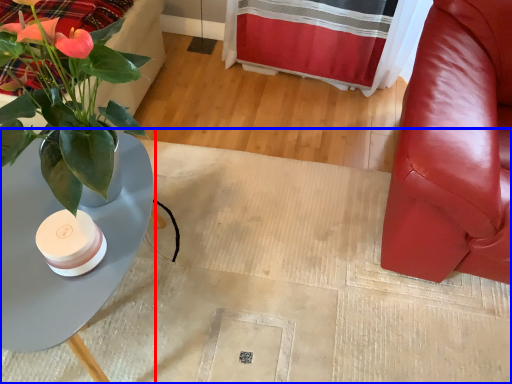
Question: Which object is further to the camera taking this photo, table (highlighted by a red box) or plain (highlighted by a blue box)?

Choices:
 (A) table
 (B) plain

Answer: (B)